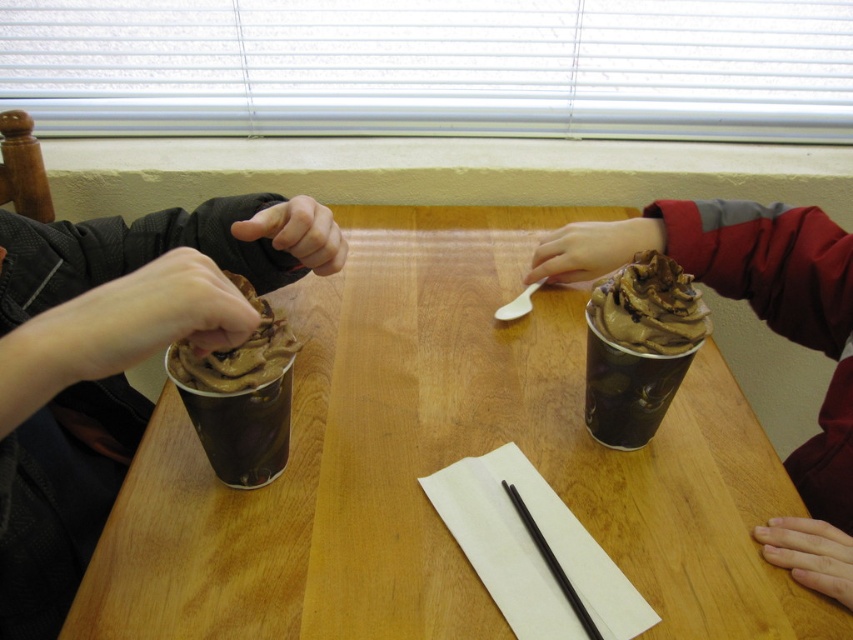
You are at a table with a chocolate matte cup at center and a chocolate frosted cupcake at left. If you want to reach for the closest item to you, which one should you choose?

The chocolate matte cup at center is closer to you than the chocolate frosted cupcake at left, so you should choose the chocolate matte cup at center.

You are a food delivery person who needs to place both the chocolate matte cup at center and the chocolate frosted cupcake at left into a delivery box. The box can only accommodate items that are no thicker than 5 centimeters. Which item might not fit if the cupcake is 6 centimeters thick?

The chocolate frosted cupcake at left might not fit because it is thicker than the chocolate matte cup at center, and if the cupcake is 6 centimeters thick, it exceeds the box limit of 5 centimeters.

You are a person sitting at the wooden table at center. You want to reach for the black plastic chopstick at center, but you have a 15cm long ruler in your hand. Can you place the ruler vertically on the table without it touching the chopstick?

The wooden table at center has a greater height compared to black plastic chopstick at center, so yes, you can place the ruler vertically on the table without it touching the chopstick since the table is taller than the chopstick.